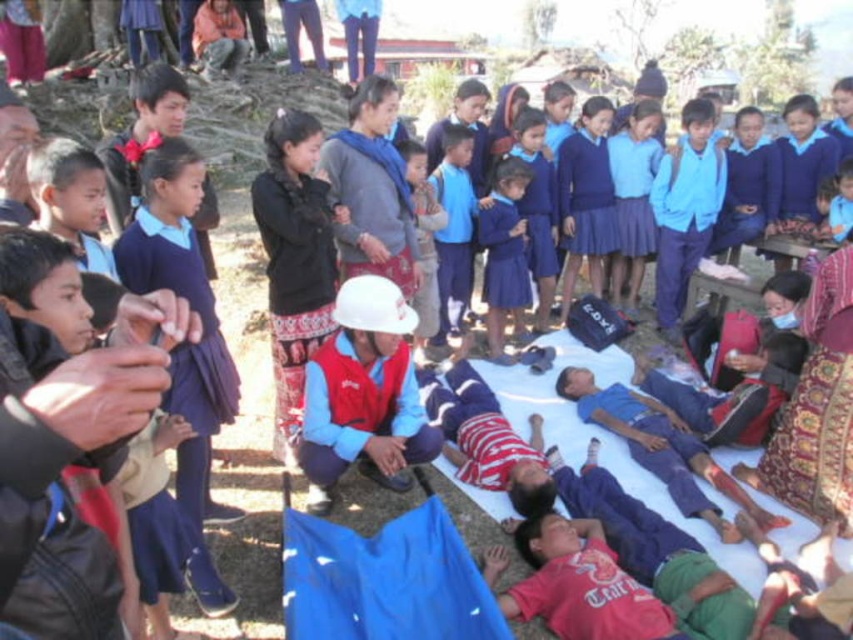
You are a photographer trying to capture a clear shot of the blue fabric skirt at center and the white matte helmet at center. Based on their sizes, which object would you need to frame more carefully to ensure it fits entirely within the camera viewfinder?

The blue fabric skirt at center might be wider than the white matte helmet at center, so you should frame the blue fabric skirt at center more carefully to ensure it fits within the camera viewfinder.